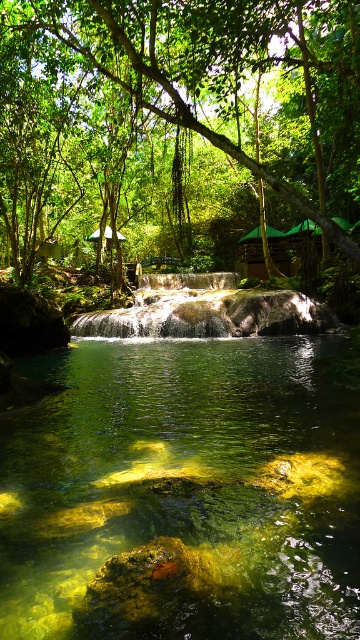
You are a hiker navigating through the forest and want to cross the translucent green water at center. Based on the coordinates provided, can you determine if the water is positioned in the middle of the scene or closer to one side?

The translucent green water at center is located at point 0.773 on the x and 0.506 on the y coordinate, which places it closer to the right side of the scene rather than the exact center.

You are a hiker standing at the edge of the forest and see the translucent green water at center and the green leafy tree at center. Which one is closer to you?

The translucent green water at center is closer to you because it is in front of the green leafy tree at center.

You are standing at the edge of the forest and see the point marked at coordinates (182,493). Based on the scene description, what is located at that point?

The point at coordinates (182,493) indicates translucent green water at center.